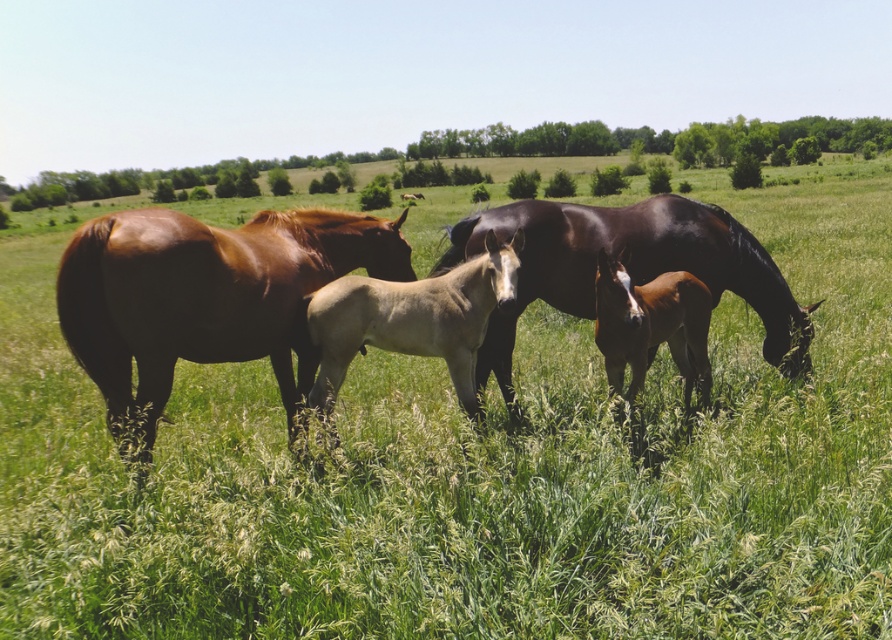
Is shiny brown horse at center smaller than glossy dark brown horse at center?

Yes.

Where is `shiny brown horse at center`? This screenshot has height=640, width=892. shiny brown horse at center is located at coordinates (205, 298).

Who is taller, shiny brown horse at center or brown glossy foal at center?

With more height is shiny brown horse at center.

Who is more forward, (x=199, y=259) or (x=659, y=326)?

Positioned in front is point (x=199, y=259).

Find the location of a particular element. shiny brown horse at center is located at coordinates (205, 298).

Who is positioned more to the left, shiny brown horse at center or light tan smooth foal at center?

shiny brown horse at center is more to the left.

Is shiny brown horse at center behind light tan smooth foal at center?

No.

Is point (108, 314) closer to viewer compared to point (432, 300)?

Yes, it is in front of point (432, 300).

Where is `shiny brown horse at center`? Image resolution: width=892 pixels, height=640 pixels. shiny brown horse at center is located at coordinates (205, 298).